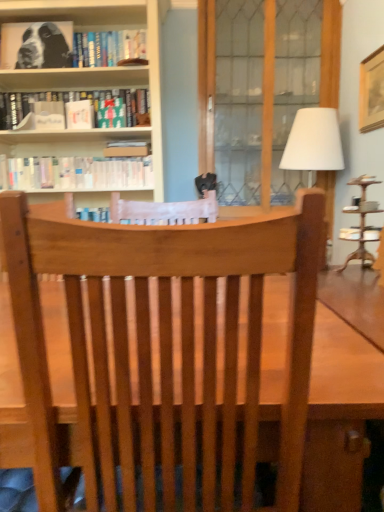
Question: Considering the positions of hardcover book at upper left, which ranks as the 2th book in bottom-to-top order, and black and white print at upper left, acting as the third book starting from the bottom, in the image, is hardcover book at upper left, which ranks as the 2th book in bottom-to-top order, wider or thinner than black and white print at upper left, acting as the third book starting from the bottom,?

Choices:
 (A) wide
 (B) thin

Answer: (A)

Question: Considering their positions, is hardcover book at upper left, which ranks as the 2th book in bottom-to-top order, located in front of or behind black and white print at upper left, acting as the third book starting from the bottom?

Choices:
 (A) front
 (B) behind

Answer: (B)

Question: Which of these objects is positioned closest to the hardcover book at upper left, arranged as the 2th book when viewed from the top?

Choices:
 (A) wooden screen door at center
 (B) wooden slatted chair at center
 (C) white matte book at upper center
 (D) white fabric lampshade at right
 (E) white paperbacks at upper left, the 1th book ordered from the bottom

Answer: (C)

Question: Based on their relative distances, which object is farther from the black and white print at upper left, arranged as the 1th book when viewed from the top?

Choices:
 (A) white matte book at upper center
 (B) white fabric lampshade at right
 (C) wooden picture frame at upper right
 (D) wooden screen door at center
 (E) hardcover book at upper left, which ranks as the 2th book in bottom-to-top order

Answer: (C)